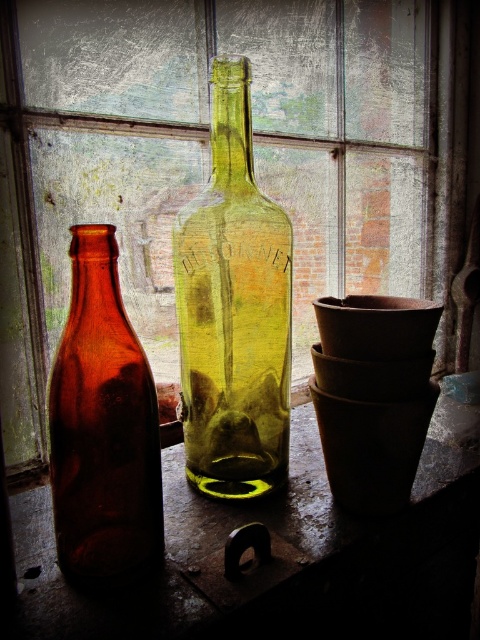
You are a photographer adjusting your camera to focus on two points in the scene. The first point is point (84, 141) and the second is point (181, 632). Which point should you focus on first if you want to capture both in sharp detail without moving the camera?

You should focus on point (84, 141) first because it is closer to the camera than point (181, 632). This way, the depth of field will likely include both points when focused on the closer one.

You are an interior designer assessing the placement of items on a windowsill. You need to determine if the transparent glass window at center will block the view of the green glass bottle at center from outside. Based on their heights, can you confirm if the bottle will be visible through the window?

The transparent glass window at center has a greater height compared to the green glass bottle at center, meaning the bottle is shorter than the window. Since the window is taller, the green glass bottle at center will be visible through the transparent glass window at center as it does not exceed the window height.

You are standing in front of a windowsill with two glass bottles and terracotta pots. There is an amber glass bottle at center and a translucent bottle to the right. A small toy car is placed at point (233, 308). If you want to move the toy car to the left of the amber glass bottle at center, will it end up to the left of the translucent bottle as well?

The point (233, 308) is where the amber glass bottle at center is located. Moving the toy car to the left of the amber glass bottle at center would place it to the left of the translucent bottle since the amber glass bottle at center is to the left of the translucent bottle.